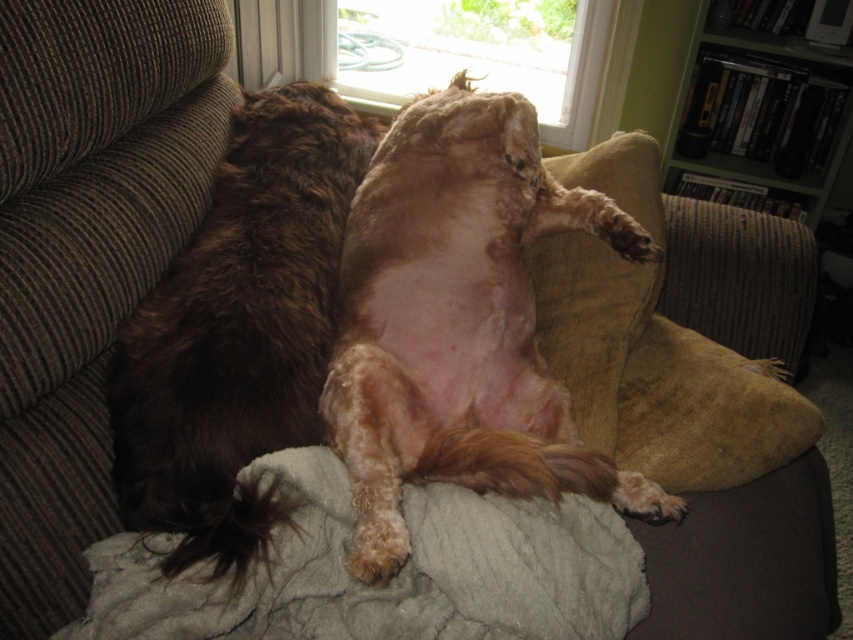
Who is higher up, brown fluffy dog at left or soft gray blanket at center?

brown fluffy dog at left

Is point (113, 368) positioned after point (267, 465)?

Yes.

I want to click on brown fluffy dog at left, so click(238, 332).

Who is positioned more to the left, fuzzy brown dog at center or brown corduroy pillow at left?

From the viewer's perspective, brown corduroy pillow at left appears more on the left side.

Is fuzzy brown dog at center taller than brown corduroy pillow at left?

Indeed, fuzzy brown dog at center has a greater height compared to brown corduroy pillow at left.

The width and height of the screenshot is (853, 640). Describe the element at coordinates (460, 323) in the screenshot. I see `fuzzy brown dog at center` at that location.

The image size is (853, 640). Identify the location of fuzzy brown dog at center. (460, 323).

Does brown corduroy pillow at left appear over transparent glass window at upper center?

Actually, brown corduroy pillow at left is below transparent glass window at upper center.

Can you confirm if brown corduroy pillow at left is shorter than transparent glass window at upper center?

Incorrect, brown corduroy pillow at left's height does not fall short of transparent glass window at upper center's.

Describe the element at coordinates (102, 241) in the screenshot. I see `brown corduroy pillow at left` at that location.

Find the location of a particular element. The height and width of the screenshot is (640, 853). brown corduroy pillow at left is located at coordinates (102, 241).